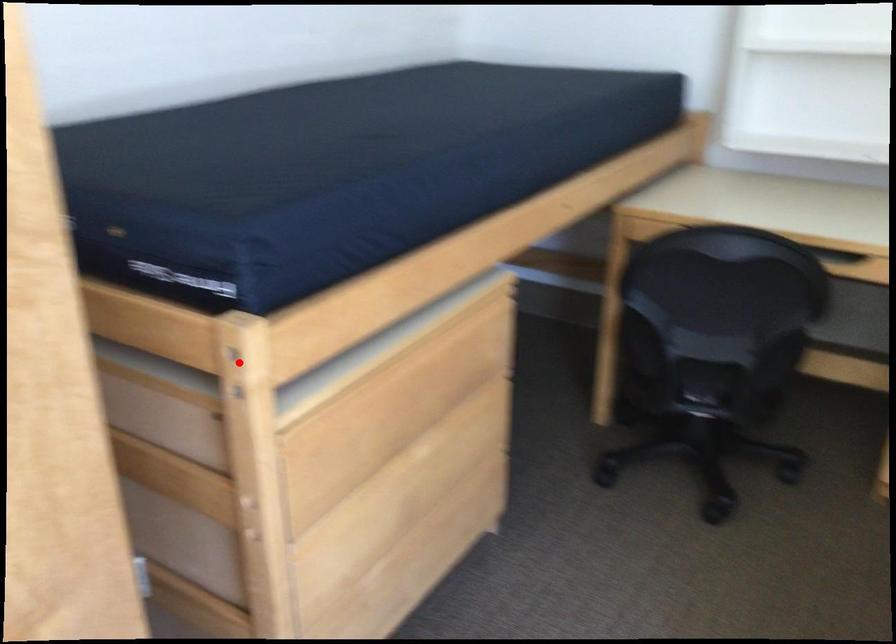
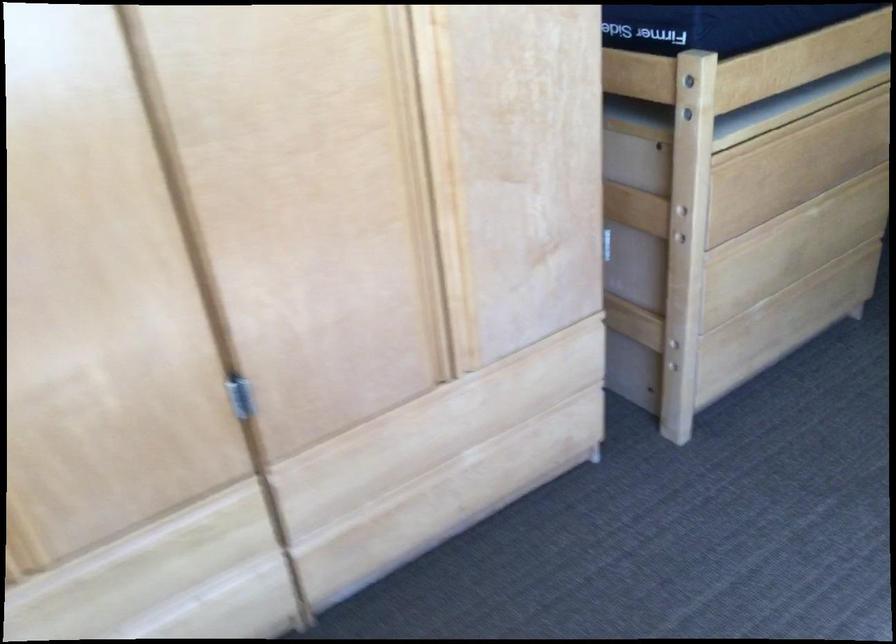
Question: I am providing you with two images of the same scene from different viewpoints. Image1 has a red point marked. In image2, the corresponding 3D location appears at what relative position? Reply with the corresponding letter.

Choices:
 (A) Closer
 (B) Farther

Answer: (B)